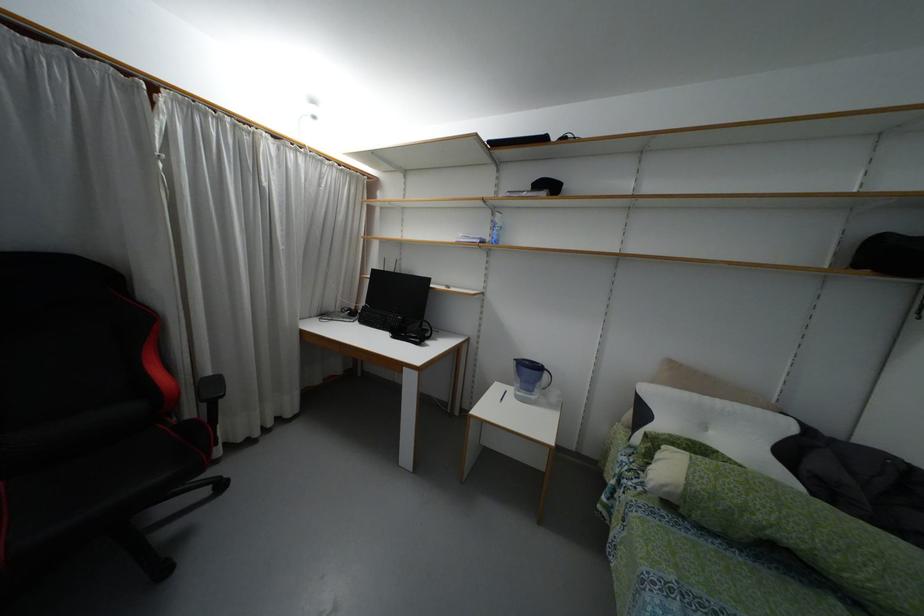
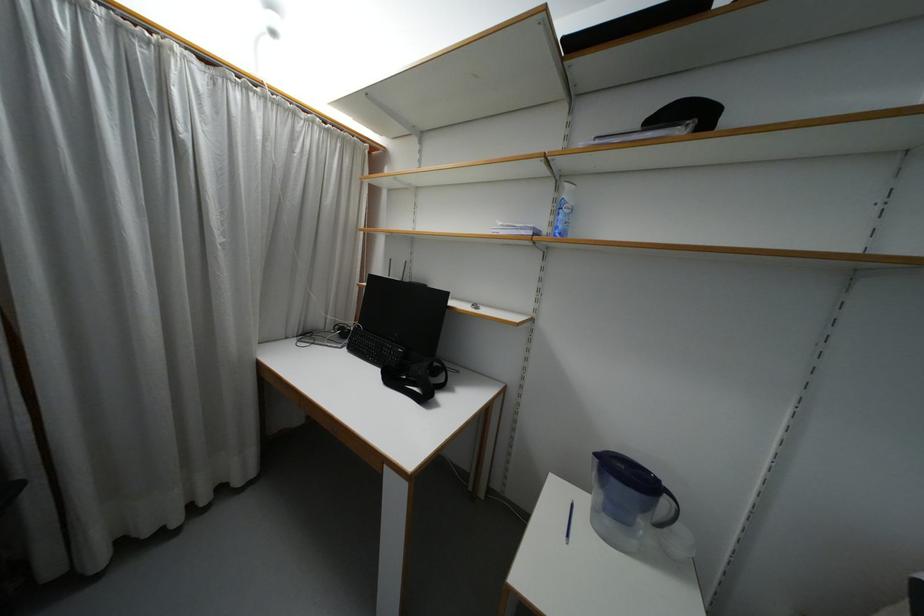
Question: The images are taken continuously from a first-person perspective. In which direction are you moving?

Choices:
 (A) Left
 (B) Right
 (C) Forward
 (D) Backward

Answer: (C)